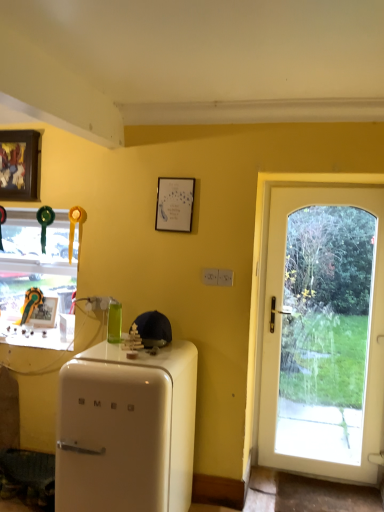
The width and height of the screenshot is (384, 512). I want to click on free point above white glossy refrigerator at lower left (from a real-world perspective), so click(x=130, y=357).